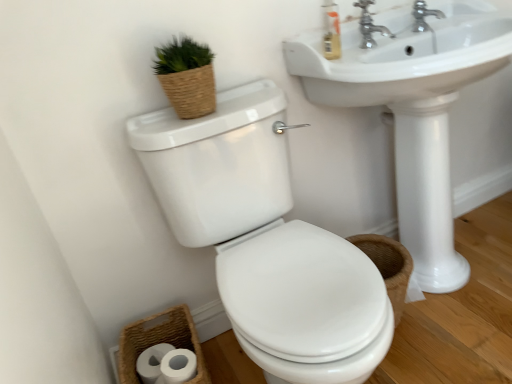
Question: Considering the relative sizes of white glossy toilet at center and white matte toilet paper at lower left in the image provided, is white glossy toilet at center bigger than white matte toilet paper at lower left?

Choices:
 (A) yes
 (B) no

Answer: (A)

Question: From a real-world perspective, is white glossy toilet at center under white matte toilet paper at lower left?

Choices:
 (A) yes
 (B) no

Answer: (B)

Question: Does white glossy toilet at center have a lesser height compared to white matte toilet paper at lower left?

Choices:
 (A) no
 (B) yes

Answer: (A)

Question: Are white glossy toilet at center and white matte toilet paper at lower left located far from each other?

Choices:
 (A) yes
 (B) no

Answer: (B)

Question: Is white glossy toilet at center further to camera compared to white matte toilet paper at lower left?

Choices:
 (A) no
 (B) yes

Answer: (A)

Question: From the image's perspective, is white glossy toilet at center over white matte toilet paper at lower left?

Choices:
 (A) no
 (B) yes

Answer: (B)

Question: Does translucent plastic soap dispenser at upper right have a smaller size compared to woven brown basket at lower left?

Choices:
 (A) no
 (B) yes

Answer: (B)

Question: Is translucent plastic soap dispenser at upper right positioned with its back to woven brown basket at lower left?

Choices:
 (A) no
 (B) yes

Answer: (A)

Question: Is translucent plastic soap dispenser at upper right completely or partially outside of woven brown basket at lower left?

Choices:
 (A) yes
 (B) no

Answer: (A)

Question: Is translucent plastic soap dispenser at upper right thinner than woven brown basket at lower left?

Choices:
 (A) no
 (B) yes

Answer: (B)

Question: Considering the relative positions of translucent plastic soap dispenser at upper right and woven brown basket at lower left in the image provided, is translucent plastic soap dispenser at upper right to the right of woven brown basket at lower left from the viewer's perspective?

Choices:
 (A) yes
 (B) no

Answer: (A)

Question: Does translucent plastic soap dispenser at upper right lie in front of woven brown basket at lower left?

Choices:
 (A) yes
 (B) no

Answer: (B)

Question: Is white glossy sink at center aimed at silver metallic faucet at upper right, the second tap positioned from the left?

Choices:
 (A) yes
 (B) no

Answer: (B)